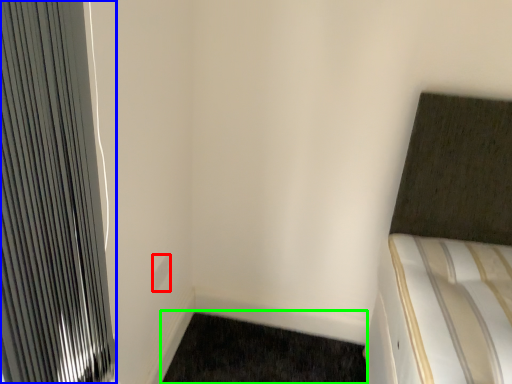
Question: Based on their relative distances, which object is nearer to electric outlet (highlighted by a red box)? Choose from radiator (highlighted by a blue box) and doormat (highlighted by a green box).

Choices:
 (A) radiator
 (B) doormat

Answer: (B)